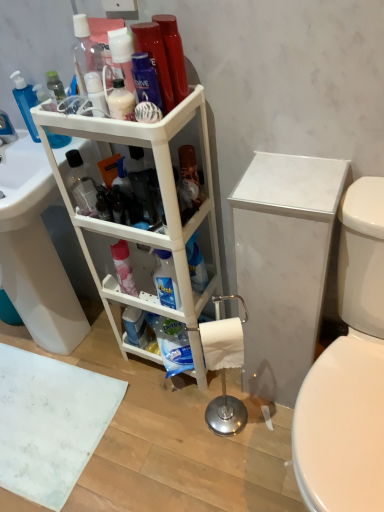
Question: From their relative heights in the image, would you say white glossy sink at lower left is taller or shorter than translucent plastic pump bottle at upper left, which appears as the first cleaning product when viewed from the top?

Choices:
 (A) short
 (B) tall

Answer: (B)

Question: From the image's perspective, is white glossy sink at lower left positioned above or below translucent plastic pump bottle at upper left, which appears as the first cleaning product when viewed from the top?

Choices:
 (A) above
 (B) below

Answer: (B)

Question: Which object is the closest to the white glossy sink at lower left?

Choices:
 (A) pink matte cleaning product at center, which is the 2th cleaning product from left to right
 (B) brushed metal faucet at left
 (C) translucent plastic pump bottle at upper left, positioned as the second cleaning product in right-to-left order
 (D) white plastic shelf at center
 (E) matte plastic lotion at center, the 2th toiletry viewed from the back

Answer: (D)

Question: Estimate the real-world distances between objects in this image. Which object is farther from the white marble cabinet at right?

Choices:
 (A) translucent plastic pump bottle at upper left, the 1th cleaning product viewed from the left
 (B) shiny plastic mouthwash at upper center
 (C) white glossy sink at lower left
 (D) blue matte container at center, the 1th toiletry positioned from the back
 (E) translucent plastic bottle at center

Answer: (A)